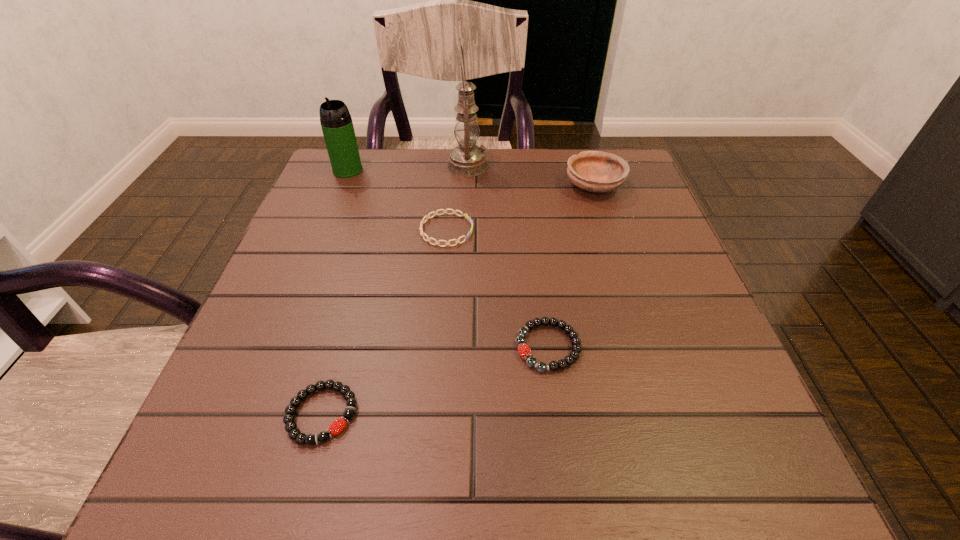
Where is `oil lamp`? This screenshot has height=540, width=960. oil lamp is located at coordinates (467, 159).

What are the coordinates of `the fifth shortest object` in the screenshot? It's located at (336, 122).

At what (x,y) coordinates should I click in order to perform the action: click on the leftmost object. Please return your answer as a coordinate pair (x, y). The width and height of the screenshot is (960, 540). Looking at the image, I should click on (336, 122).

Where is `bowl`? The height and width of the screenshot is (540, 960). bowl is located at coordinates (595, 171).

Where is `the third tallest object`? the third tallest object is located at coordinates (595, 171).

Where is `the second nearest bracelet`? The height and width of the screenshot is (540, 960). the second nearest bracelet is located at coordinates (524, 350).

You are a GUI agent. You are given a task and a screenshot of the screen. Output one action in this format:
    pyautogui.click(x=<x>, y=<y>)
    Task: Click on the rightmost bracelet
    The image size is (960, 540).
    Given the screenshot: What is the action you would take?
    pyautogui.click(x=524, y=350)

Identify the location of the nearest bracelet. The width and height of the screenshot is (960, 540). (335, 428).

Identify the location of the leftmost bracelet. (335, 428).

This screenshot has height=540, width=960. What are the coordinates of `the fourth farthest object` in the screenshot? It's located at (444, 211).